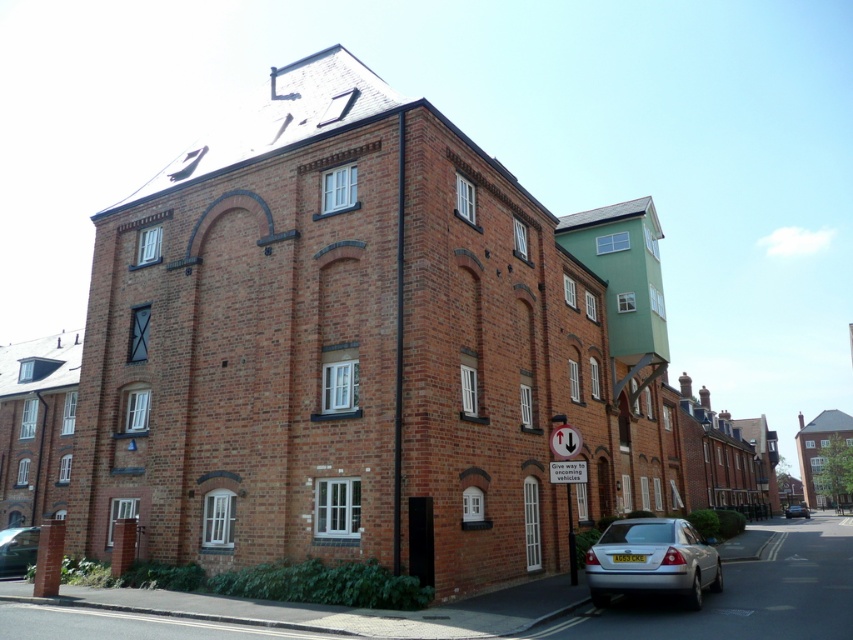
Can you confirm if silver metallic sedan at lower right is wider than white plastic sign at lower center?

Yes.

Does point (622, 573) come behind point (567, 426)?

No, it is in front of (567, 426).

Locate an element on the screen. The width and height of the screenshot is (853, 640). silver metallic sedan at lower right is located at coordinates click(x=653, y=561).

Can you confirm if silver metallic sedan at lower right is wider than metallic silver car at lower left?

No, silver metallic sedan at lower right is not wider than metallic silver car at lower left.

Who is more distant from viewer, (671,552) or (15,547)?

Point (15,547)

Where is `silver metallic sedan at lower right`? silver metallic sedan at lower right is located at coordinates (653, 561).

Which of these two, metallic silver car at lower left or silver metallic car at center, stands taller?

Standing taller between the two is silver metallic car at center.

Between point (30, 548) and point (798, 516), which one is positioned behind?

The point (798, 516) is behind.

Does point (24, 536) come closer to viewer compared to point (799, 512)?

Yes, point (24, 536) is in front of point (799, 512).

Identify the location of metallic silver car at lower left. Image resolution: width=853 pixels, height=640 pixels. (16, 548).